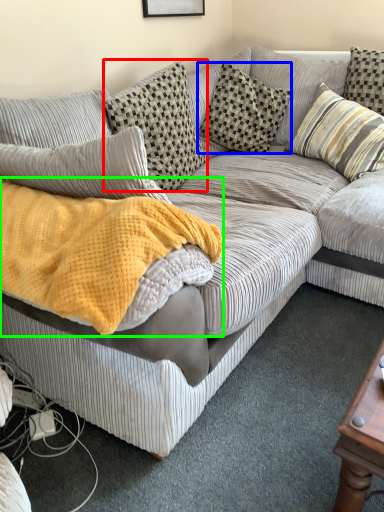
Question: Considering the real-world distances, which object is closest to pillow (highlighted by a red box)? pillow (highlighted by a blue box) or blanket (highlighted by a green box).

Choices:
 (A) pillow
 (B) blanket

Answer: (A)